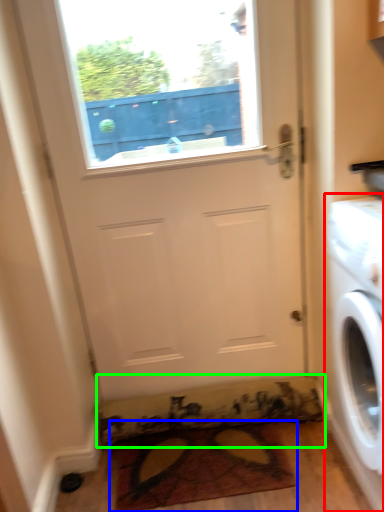
Question: Considering the real-world distances, which object is closest to washing machine (highlighted by a red box)? doormat (highlighted by a blue box) or doormat (highlighted by a green box).

Choices:
 (A) doormat
 (B) doormat

Answer: (A)